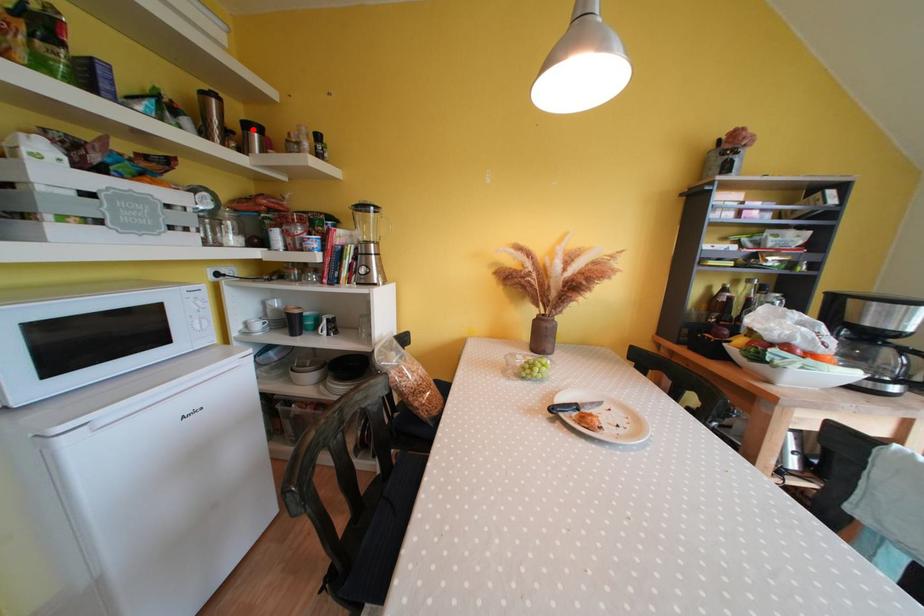
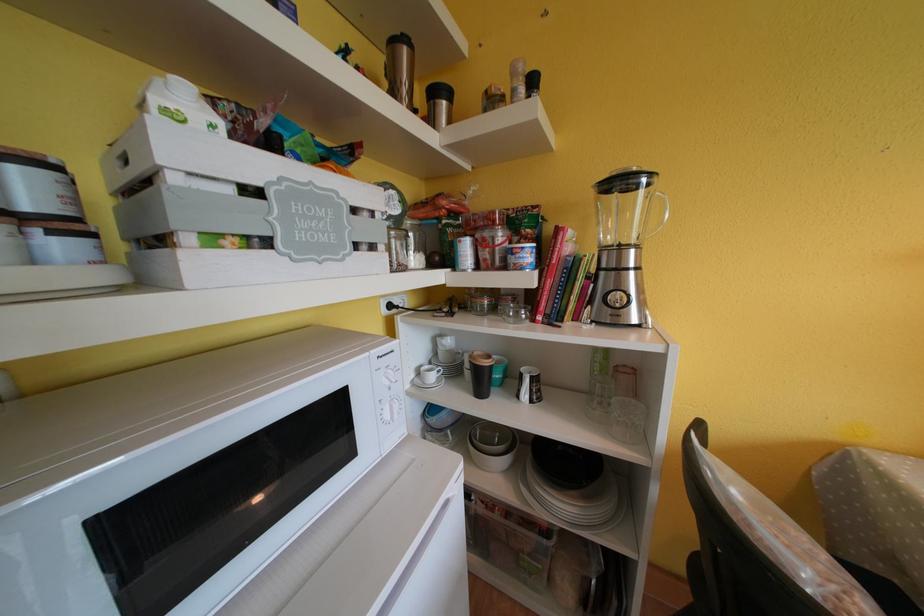
The point at the highlighted location is marked in the first image. Where is the corresponding point in the second image?

(440, 95)